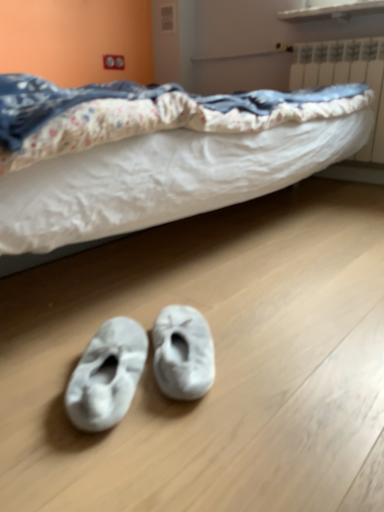
The height and width of the screenshot is (512, 384). In order to click on free space to the left of white fuzzy slippers at lower center, the 1th footwear viewed from the right in this screenshot , I will do `click(61, 362)`.